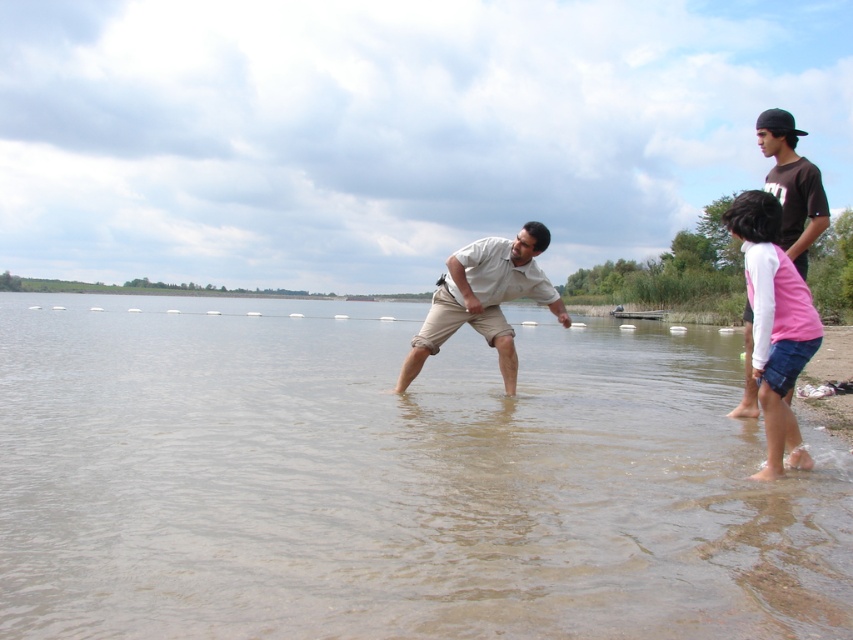
In the scene shown: You are a photographer standing at the lakeside. You want to take a photo of the pink fabric shorts at lower right and the beige cotton shirt at center. The camera has a maximum focus range of 2.5 meters. Can you capture both subjects in focus without moving the camera?

The distance between the pink fabric shorts at lower right and the beige cotton shirt at center is 2.58 meters. Since the camera can only focus within 2.5 meters, the subjects are slightly out of the focus range. You might need to adjust your position or use a different camera setting to ensure both are in focus.

You are standing at the point labeled point (485, 321) and want to walk to the point labeled point (769, 339). Based on the scene description, will you have to walk towards the water or away from it?

Since point (769, 339) is in front of point (485, 321), you will have to walk towards the water to reach it.

You are planning to cross the clear water at center to reach the pink fabric shorts at lower right. Considering their widths, which one is wider?

The clear water at center is wider than the pink fabric shorts at lower right, so the water is wider.